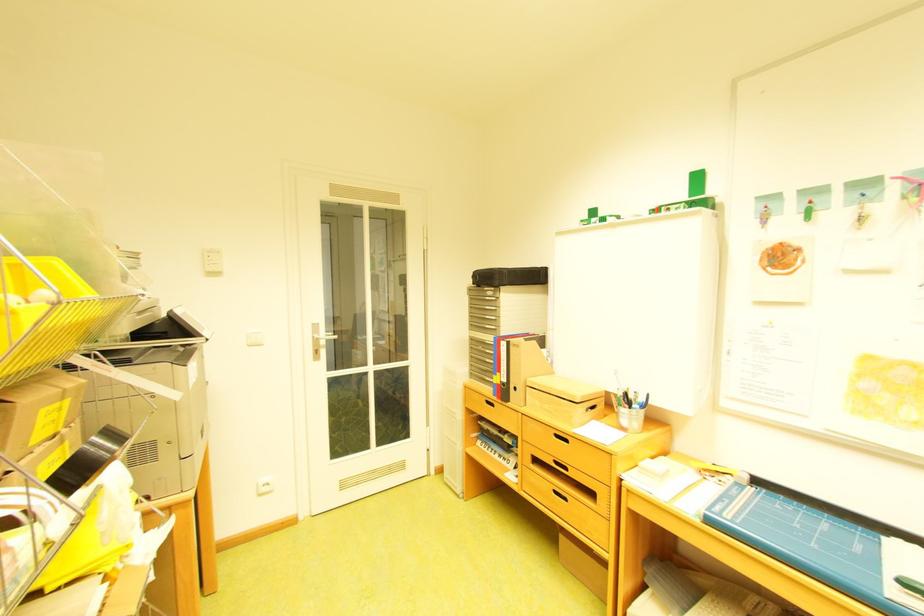
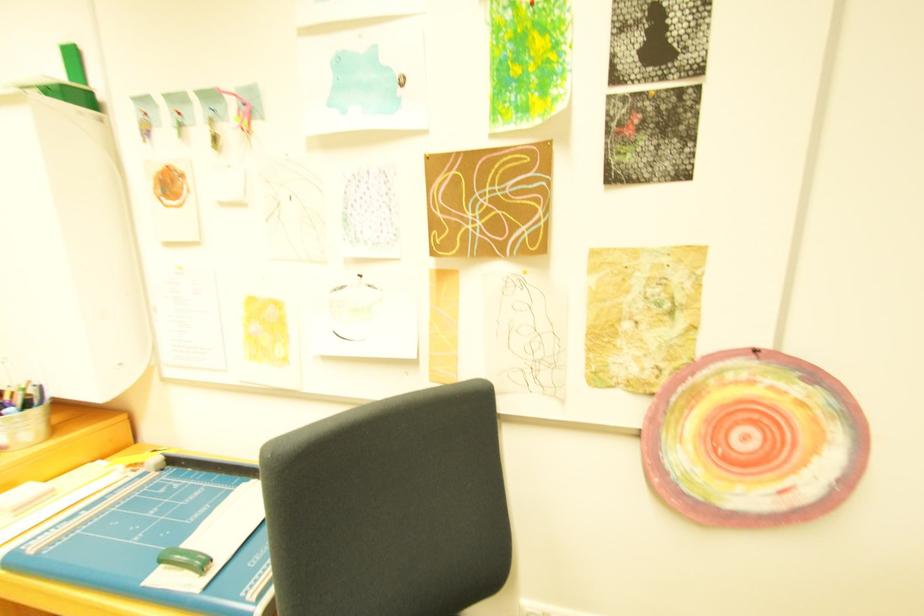
Question: The images are taken continuously from a first-person perspective. In which direction is your viewpoint rotating?

Choices:
 (A) Left
 (B) Right
 (C) Up
 (D) Down

Answer: (B)